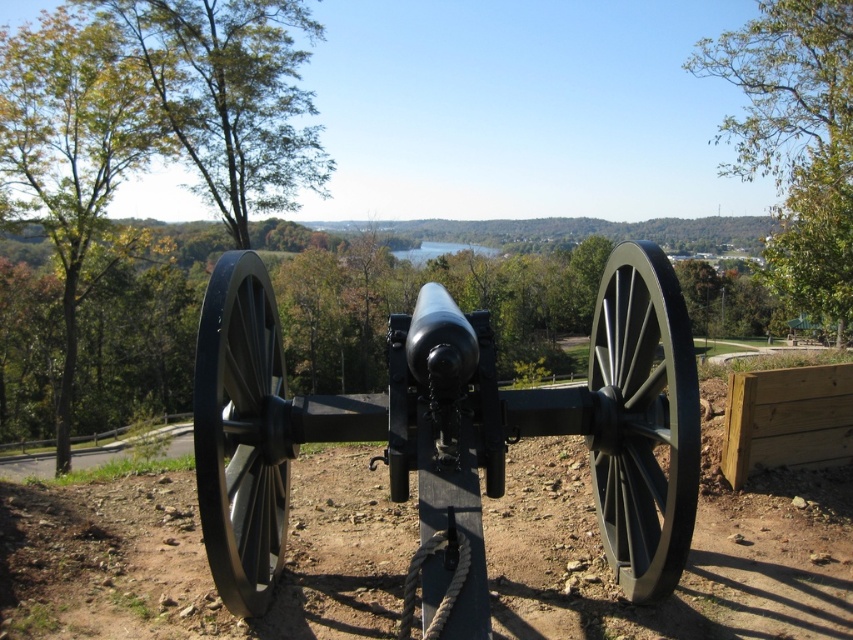
You are an artist sketching the scene and want to ensure accuracy. Which tree, the green leafy tree at upper right or the green leafy tree at left, should you draw as narrower in your sketch?

The green leafy tree at upper right should be drawn as narrower because its width is less than the green leafy tree at left.

You are standing near the cannon and want to determine which tree is taller. You see the green leafy tree at upper right and the green leafy tree at left. Which one is taller?

The green leafy tree at left is taller than the green leafy tree at upper right.

You are standing in front of the historical cannon and want to take a photo that includes both the green leafy tree at upper right and the green leafy tree at left. Which tree should you position closer to the cannon to ensure both are fully visible in the frame?

You should position the green leafy tree at upper right closer to the cannon because it is in front of the green leafy tree at left, so placing it nearer will help both trees fit within the camera frame without one blocking the other.